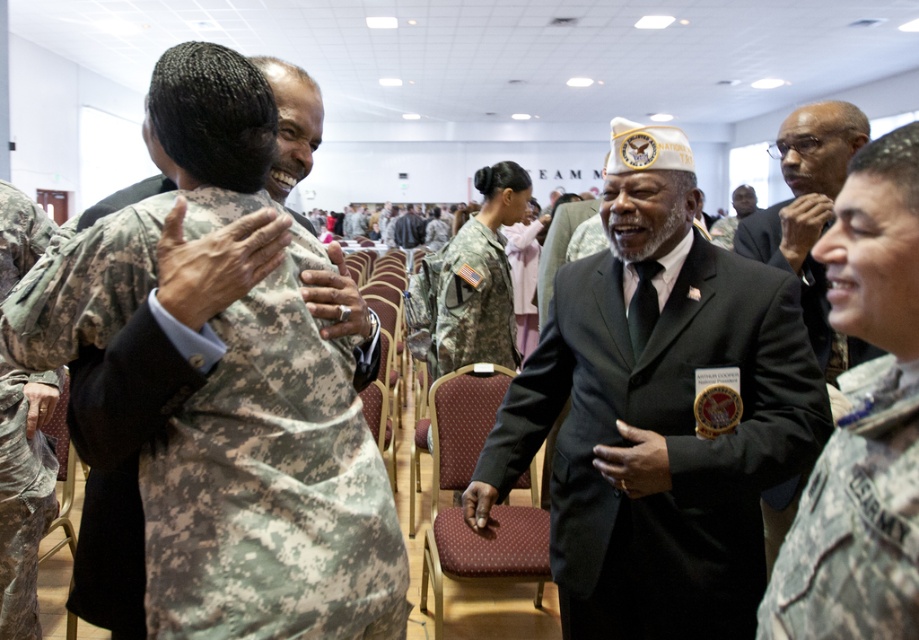
Question: Which object appears closest to the camera in this image?

Choices:
 (A) camouflage fabric uniform at lower right
 (B) camouflage fabric uniform at center

Answer: (A)

Question: Does matte black suit at center have a larger size compared to camouflage fabric uniform at lower right?

Choices:
 (A) no
 (B) yes

Answer: (B)

Question: Which point is farther from the camera taking this photo?

Choices:
 (A) (449, 476)
 (B) (821, 557)

Answer: (A)

Question: From the image, what is the correct spatial relationship of camouflage fabric uniform at lower right in relation to maroon fabric chair at center?

Choices:
 (A) above
 (B) below

Answer: (A)

Question: Does camouflage uniform at left have a lesser width compared to matte black suit at center?

Choices:
 (A) yes
 (B) no

Answer: (A)

Question: Among these objects, which one is farthest from the camera?

Choices:
 (A) dark gray suit at center
 (B) maroon fabric chair at center
 (C) camouflage fabric uniform at lower right

Answer: (B)